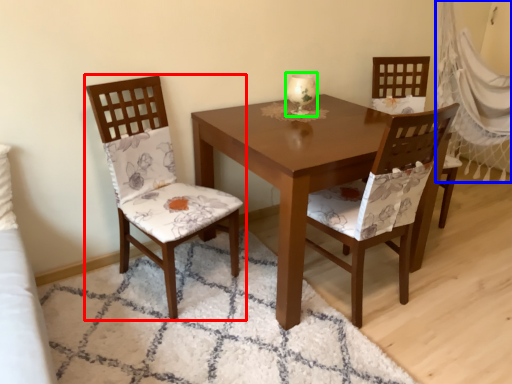
Question: Based on their relative distances, which object is nearer to chair (highlighted by a red box)? Choose from curtain (highlighted by a blue box) and candle holder (highlighted by a green box).

Choices:
 (A) curtain
 (B) candle holder

Answer: (B)